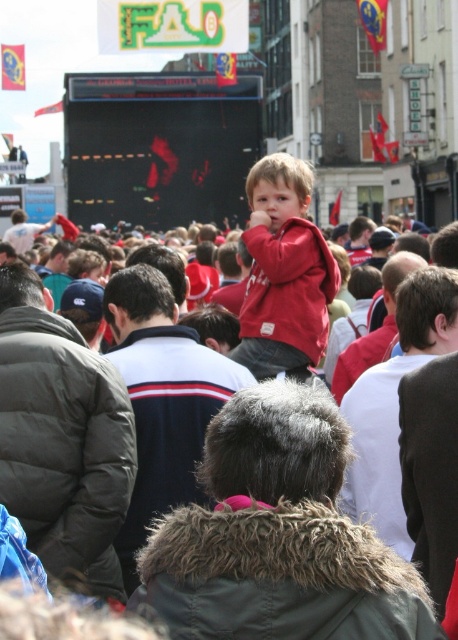
Question: Estimate the real-world distances between objects in this image. Which object is closer to the fur-lined green jacket at center?

Choices:
 (A) matte red hoodie at center
 (B) dark blue fleece jacket at center
 (C) dark gray jacket at center
 (D) dark gray puffer jacket at center

Answer: (B)

Question: Does red fleece jacket at center have a greater width compared to dark gray jacket at center?

Choices:
 (A) no
 (B) yes

Answer: (B)

Question: Which point is closer to the camera?

Choices:
 (A) dark gray puffer jacket at center
 (B) dark gray jacket at center
 (C) dark gray puffer jacket at left

Answer: (C)

Question: Observing the image, what is the correct spatial positioning of matte red hoodie at center in reference to dark gray puffer jacket at center?

Choices:
 (A) left
 (B) right

Answer: (B)

Question: Which point appears farthest from the camera in this image?

Choices:
 (A) (391, 310)
 (B) (312, 598)

Answer: (A)

Question: Does dark gray jacket at center appear over dark gray puffer jacket at center?

Choices:
 (A) yes
 (B) no

Answer: (B)